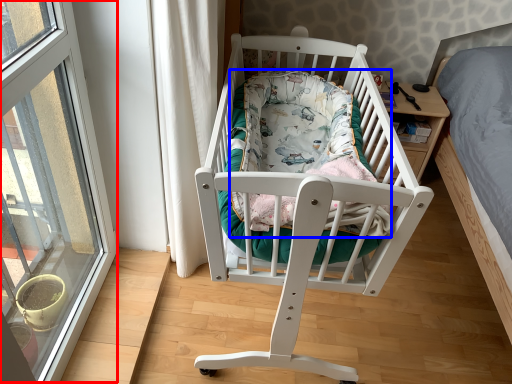
Question: Among these objects, which one is farthest to the camera, window (highlighted by a red box) or mattress (highlighted by a blue box)?

Choices:
 (A) window
 (B) mattress

Answer: (B)